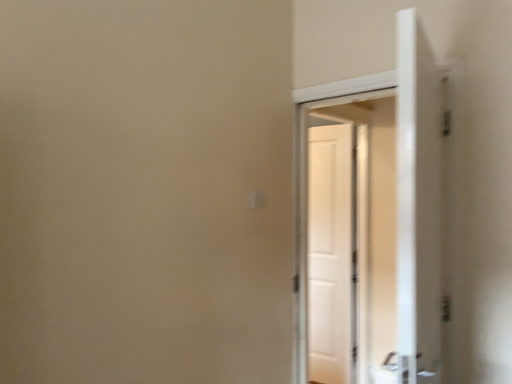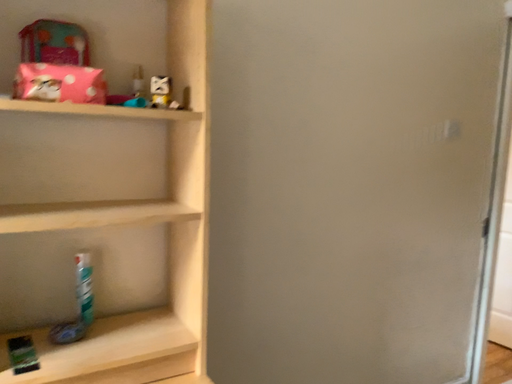
Question: How did the camera likely rotate when shooting the video?

Choices:
 (A) rotated left
 (B) rotated right

Answer: (A)